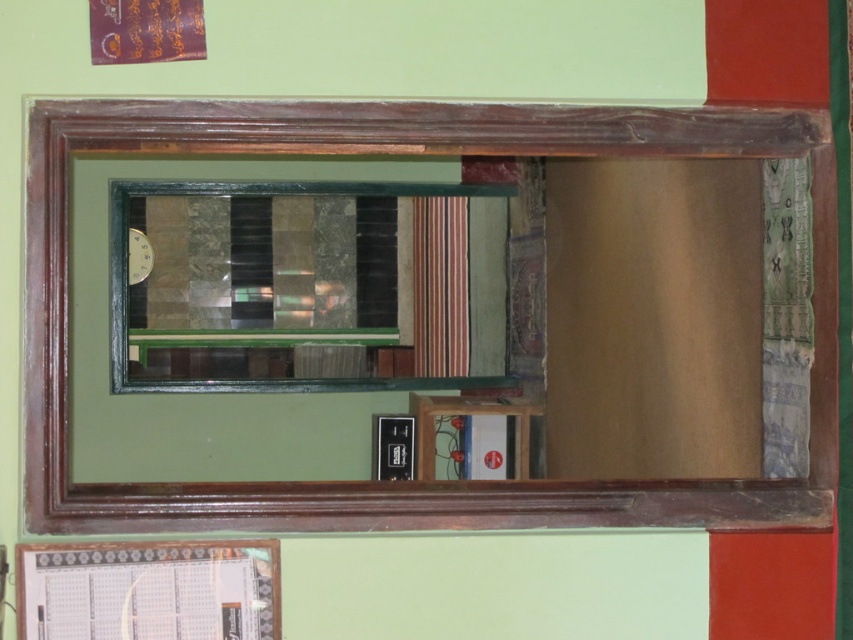
Can you confirm if wooden mirror at center is bigger than green glass window at center?

No, wooden mirror at center is not bigger than green glass window at center.

Does point (48, 220) lie behind point (357, 243)?

No, (48, 220) is in front of (357, 243).

Is point (538, 524) positioned behind point (206, 266)?

That is False.

Identify the location of wooden mirror at center. (402, 154).